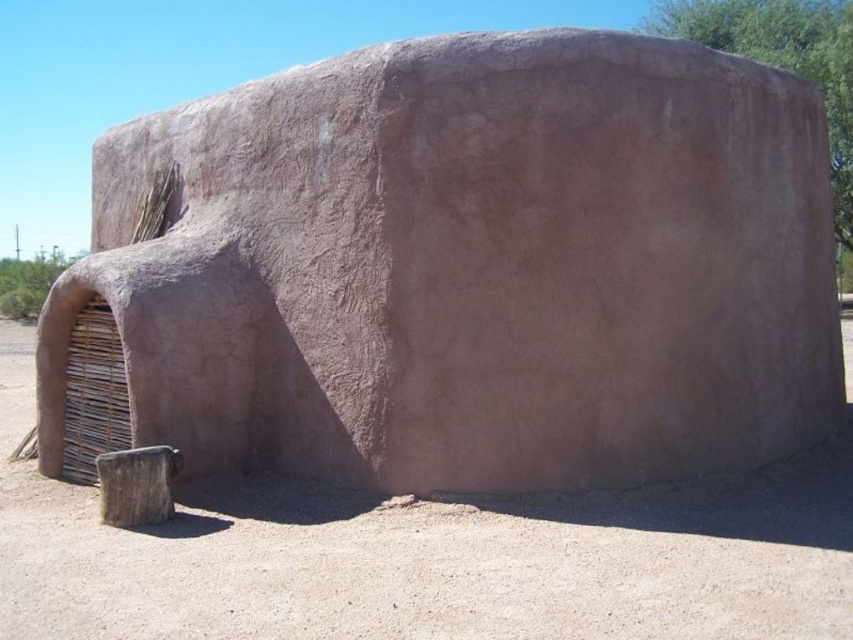
Which is below, brown clay structure at center or brown rough wood stump at lower left?

brown rough wood stump at lower left

Who is more forward, (440,240) or (120,508)?

Point (120,508) is more forward.

I want to click on brown clay structure at center, so click(x=460, y=272).